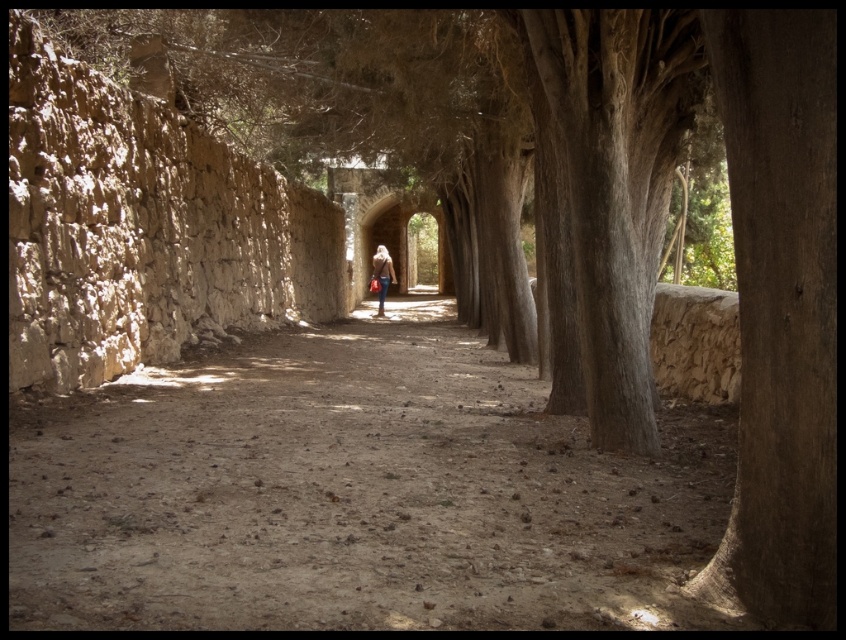
You are standing on the dirt ground at center and looking towards the stone wall on the left. Is the denim jacket at center closer to you than the stone wall?

The dirt ground at center is in front of the denim jacket at center, meaning the denim jacket is behind the ground you are standing on. Since the stone wall is on the left side of the path, the denim jacket at center is farther away from you than the stone wall.